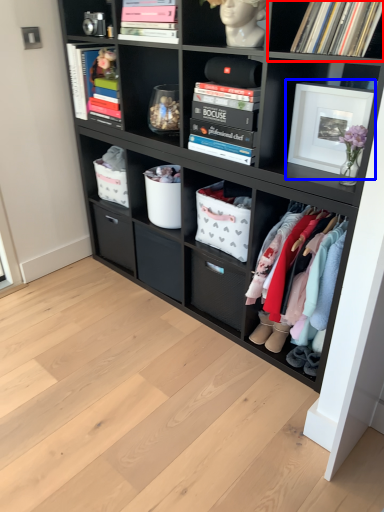
Question: Which point is further to the camera, shelf (highlighted by a red box) or picture frame (highlighted by a blue box)?

Choices:
 (A) shelf
 (B) picture frame

Answer: (B)